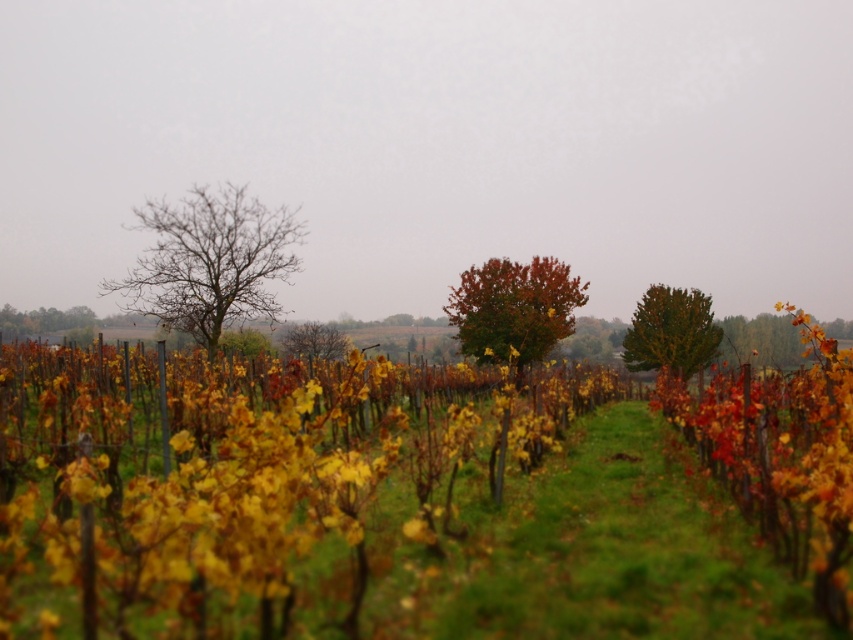
Is point (517, 320) positioned in front of point (341, 339)?

Yes, it is.

Between autumn leaves tree at center and autumn leaves at center, which one appears on the left side from the viewer's perspective?

autumn leaves at center is more to the left.

This screenshot has height=640, width=853. In order to click on autumn leaves tree at center in this screenshot , I will do `click(514, 307)`.

Can you confirm if bare branches at left is positioned above green matte tree at left?

Yes.

Does bare branches at left have a lesser width compared to green matte tree at left?

Correct, bare branches at left's width is less than green matte tree at left's.

Is point (271, 211) farther from camera compared to point (4, 332)?

That is False.

Where is `bare branches at left`? This screenshot has height=640, width=853. bare branches at left is located at coordinates (210, 260).

Can you confirm if autumn leaves tree at center is bigger than green matte tree at left?

Indeed, autumn leaves tree at center has a larger size compared to green matte tree at left.

Who is shorter, autumn leaves tree at center or green matte tree at left?

With less height is green matte tree at left.

Who is more forward, [527,276] or [68,316]?

Point [527,276] is in front.

Locate an element on the screen. autumn leaves tree at center is located at coordinates (514, 307).